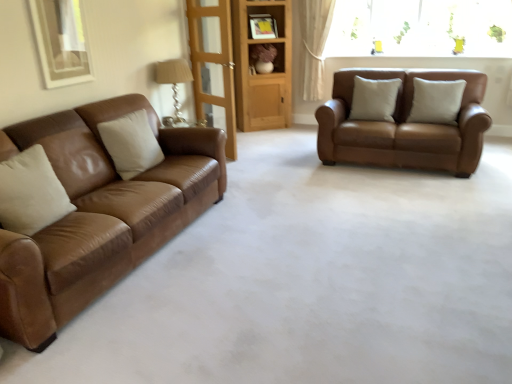
Question: In the image, is white leather pillow at center, acting as the first pillow starting from the right, on the left side or the right side of transparent glass door at center?

Choices:
 (A) right
 (B) left

Answer: (A)

Question: In terms of height, does white leather pillow at center, acting as the first pillow starting from the right, look taller or shorter compared to transparent glass door at center?

Choices:
 (A) tall
 (B) short

Answer: (B)

Question: Estimate the real-world distances between objects in this image. Which object is farther from the matte brown shelf at center?

Choices:
 (A) white sheer curtain at upper right
 (B) beige leather pillow at center, positioned as the third pillow in front-to-back order
 (C) matte brown leather couch at left, placed as the second studio couch when sorted from right to left
 (D) white leather pillow at center, positioned as the third pillow in left-to-right order
 (E) transparent glass door at center

Answer: (C)

Question: Which is nearer to the matte brown leather couch at left, which is the 2th studio couch from back to front?

Choices:
 (A) wooden bookshelf at center
 (B) white leather pillow at center, the 2th pillow in the back-to-front sequence
 (C) white leather pillow at left, which is the third pillow in back-to-front order
 (D) saddle brown leather sofa at right, marked as the second studio couch in a left-to-right arrangement
 (E) transparent glass door at center

Answer: (C)